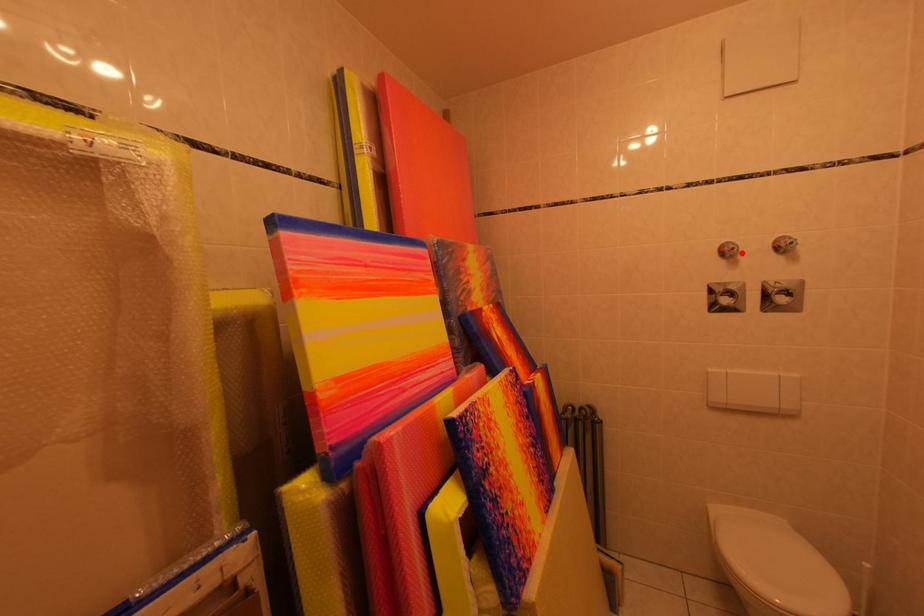
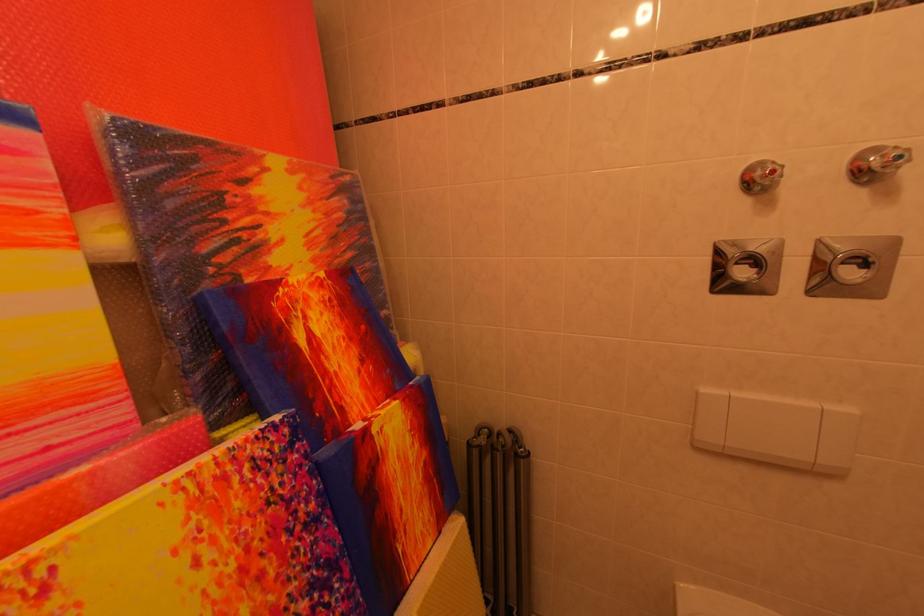
Locate, in the second image, the point that corresponds to the highlighted location in the first image.

(782, 176)